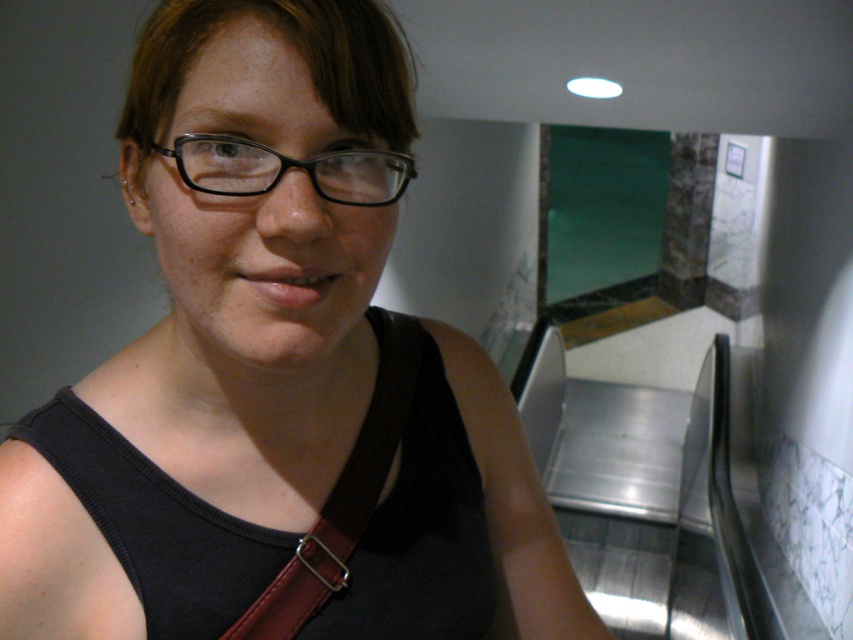
Question: Can you confirm if black fabric tank top at center is thinner than black plastic glasses at upper center?

Choices:
 (A) no
 (B) yes

Answer: (A)

Question: Which of the following is the farthest from the observer?

Choices:
 (A) (416, 324)
 (B) (193, 156)
 (C) (520, 449)

Answer: (C)

Question: Which object is farther from the camera taking this photo?

Choices:
 (A) black plastic glasses at upper center
 (B) brown leather strap at center
 (C) black fabric tank top at center

Answer: (B)

Question: Can you confirm if black fabric tank top at center is thinner than brown leather strap at center?

Choices:
 (A) no
 (B) yes

Answer: (A)

Question: Does black fabric tank top at center appear over black plastic glasses at upper center?

Choices:
 (A) no
 (B) yes

Answer: (A)

Question: Which of the following is the closest to the observer?

Choices:
 (A) (374, 154)
 (B) (404, 369)
 (C) (0, 536)

Answer: (A)